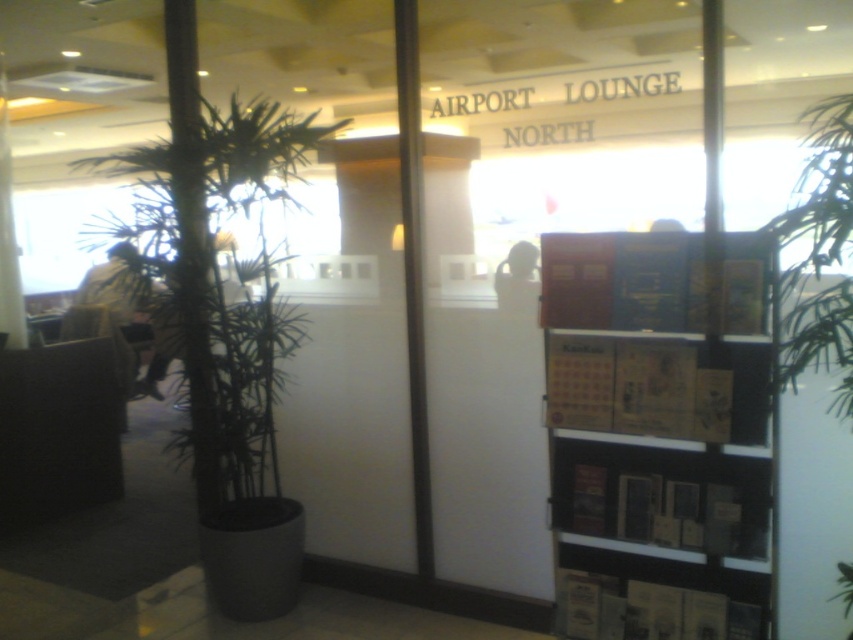
Can you confirm if wooden bookshelf at right is positioned above green leafy plant at left?

No.

Can you confirm if wooden bookshelf at right is bigger than green leafy plant at left?

Incorrect, wooden bookshelf at right is not larger than green leafy plant at left.

Between point (582, 314) and point (160, 193), which one is positioned in front?

Point (582, 314)

At what (x,y) coordinates should I click in order to perform the action: click on wooden bookshelf at right. Please return your answer as a coordinate pair (x, y). Looking at the image, I should click on click(660, 413).

Does green leafy plant at left have a lesser width compared to green leafy plant at center?

No, green leafy plant at left is not thinner than green leafy plant at center.

Between point (260, 253) and point (846, 305), which one is positioned in front?

Point (846, 305)

Where is `green leafy plant at left`? The width and height of the screenshot is (853, 640). green leafy plant at left is located at coordinates (221, 282).

Locate an element on the screen. This screenshot has width=853, height=640. green leafy plant at left is located at coordinates (221, 282).

Is green leafy plant at left thinner than green bamboo at left?

No, green leafy plant at left is not thinner than green bamboo at left.

From the picture: Can you confirm if green leafy plant at left is taller than green bamboo at left?

Incorrect, green leafy plant at left's height is not larger of green bamboo at left's.

Describe the element at coordinates (221, 282) in the screenshot. I see `green leafy plant at left` at that location.

Locate an element on the screen. The height and width of the screenshot is (640, 853). green leafy plant at left is located at coordinates (221, 282).